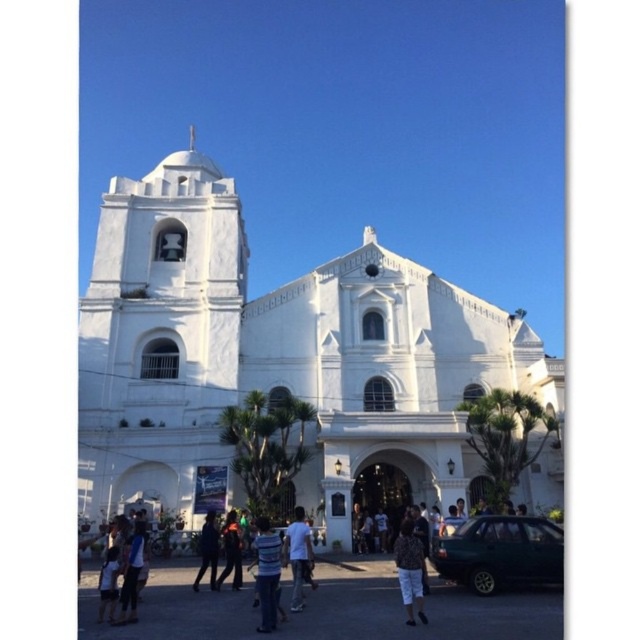
Who is more distant from viewer, [465,524] or [124,570]?

Point [465,524]

Is green matte car at lower right wider than light blue shirt at lower left?

Indeed, green matte car at lower right has a greater width compared to light blue shirt at lower left.

Is point (512, 572) farther from viewer compared to point (136, 552)?

Yes, point (512, 572) is farther from viewer.

Image resolution: width=640 pixels, height=640 pixels. Identify the location of green matte car at lower right. (500, 552).

Is striped shirt at center to the right of light blue shirt at lower left from the viewer's perspective?

Yes, striped shirt at center is to the right of light blue shirt at lower left.

Is point (262, 611) positioned in front of point (128, 570)?

Yes, point (262, 611) is closer to viewer.

Which is behind, point (269, 538) or point (134, 573)?

The point (134, 573) is more distant.

Locate an element on the screen. striped shirt at center is located at coordinates (266, 573).

Can you confirm if green matte car at lower right is positioned below dark blue fabric at center?

Incorrect, green matte car at lower right is not positioned below dark blue fabric at center.

Find the location of a particular element. Image resolution: width=640 pixels, height=640 pixels. green matte car at lower right is located at coordinates (500, 552).